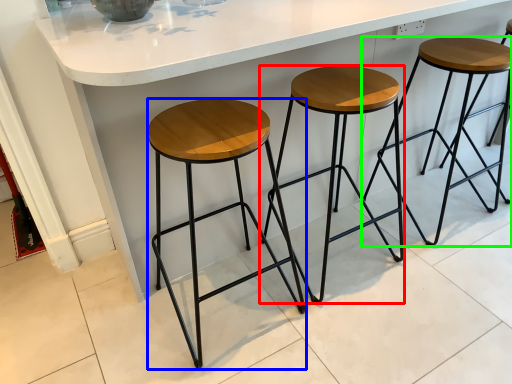
Question: Which object is the closest to the stool (highlighted by a red box)? Choose among these: stool (highlighted by a blue box) or stool (highlighted by a green box).

Choices:
 (A) stool
 (B) stool

Answer: (A)